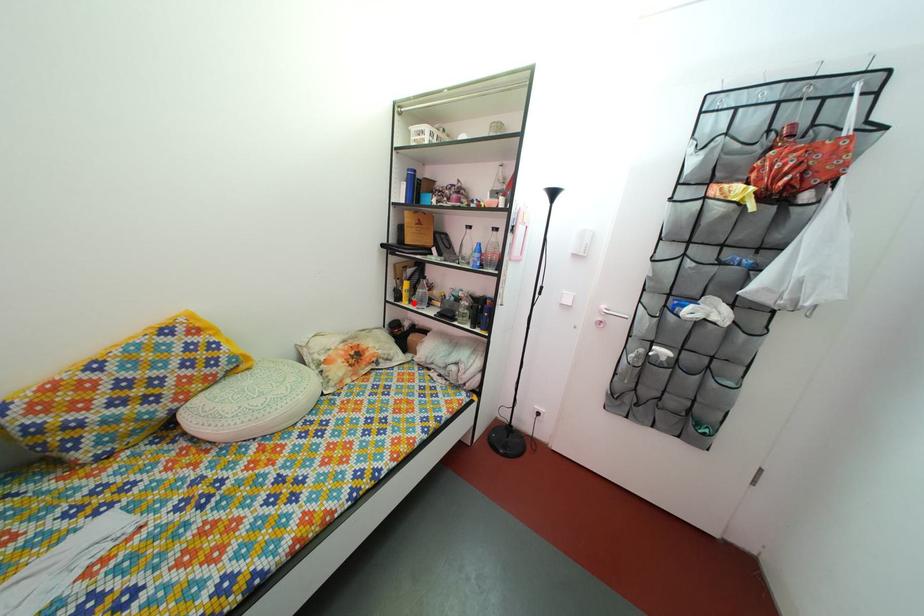
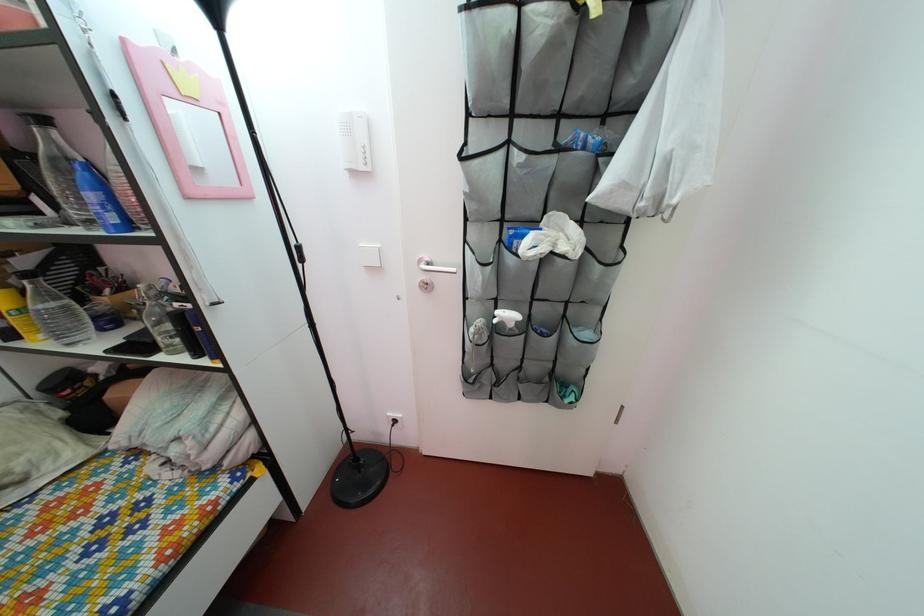
Find the pixel in the second image that matches the highlighted location in the first image.

(27, 330)